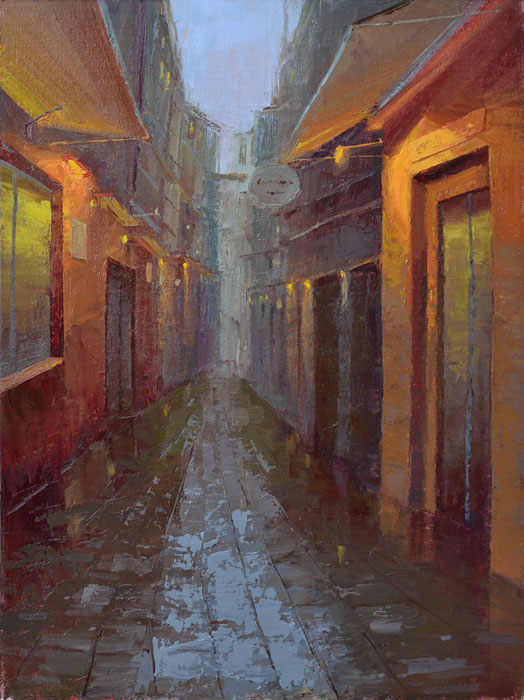
The image size is (524, 700). I want to click on the left side door, so click(x=118, y=321).